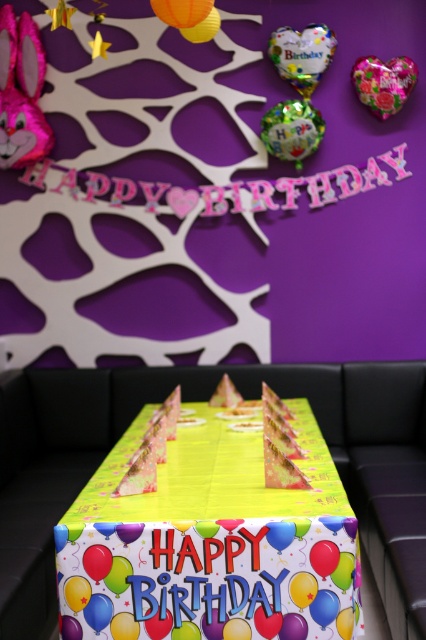
You are at a birthday party and see the yellow paper table at center and the yellow paper cake at center. Which object is taller?

The yellow paper table at center is taller than the yellow paper cake at center.

You are a guest at the birthday party and want to place a small gift on the table. The gift is 10 cm tall. The table has limited space between the pink metallic heart at upper center and the yellow paper cake at center. Can the gift fit vertically between them?

The pink metallic heart at upper center is taller than the yellow paper cake at center, so the vertical space between them is at least 10 cm. Therefore, the gift can fit vertically between them.

In the scene shown: You are at a birthday party and see the pink metallic heart at upper center and the yellow paper cake at center. Which object is positioned to the right of the other?

The pink metallic heart at upper center is to the right of the yellow paper cake at center.